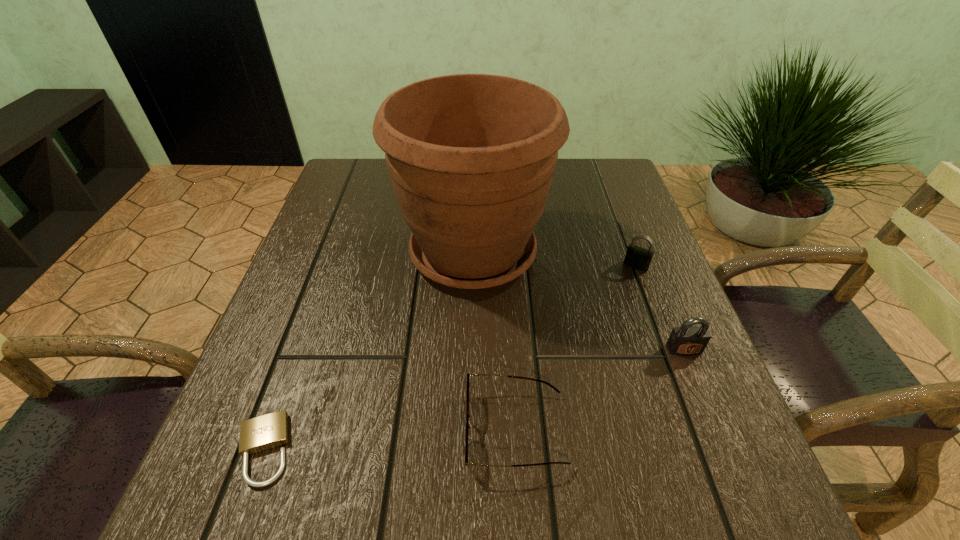
This screenshot has height=540, width=960. I want to click on the tallest object, so click(x=471, y=157).

Locate an element on the screen. the second nearest padlock is located at coordinates (687, 340).

At what (x,y) coordinates should I click in order to perform the action: click on the farthest padlock. Please return your answer as a coordinate pair (x, y). The height and width of the screenshot is (540, 960). Looking at the image, I should click on (636, 257).

Where is `the fourth tallest object`? the fourth tallest object is located at coordinates (468, 374).

At what (x,y) coordinates should I click in order to perform the action: click on the shortest object. Please return your answer as a coordinate pair (x, y). Looking at the image, I should click on (264, 432).

Find the location of a particular element. The height and width of the screenshot is (540, 960). the shortest padlock is located at coordinates (264, 432).

Identify the location of vacant space located 0.190m on the left of the tallest object. The image size is (960, 540). (309, 253).

Find the location of a particular element. The width and height of the screenshot is (960, 540). blank space located on the front of the second nearest padlock near the keyhole is located at coordinates coord(747,502).

Locate an element on the screen. free space located on the front of the farthest padlock is located at coordinates (677, 373).

Identify the location of vacant area located 0.200m on the face of the spectacles. (336, 430).